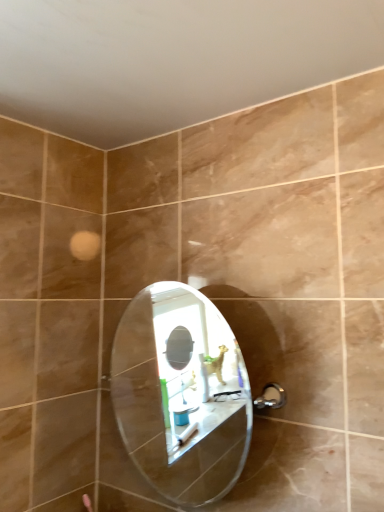
Image resolution: width=384 pixels, height=512 pixels. What do you see at coordinates (181, 393) in the screenshot?
I see `clear glass mirror at center` at bounding box center [181, 393].

The image size is (384, 512). I want to click on clear glass mirror at center, so click(x=181, y=393).

Find the location of `clear glass mirror at center`. clear glass mirror at center is located at coordinates (181, 393).